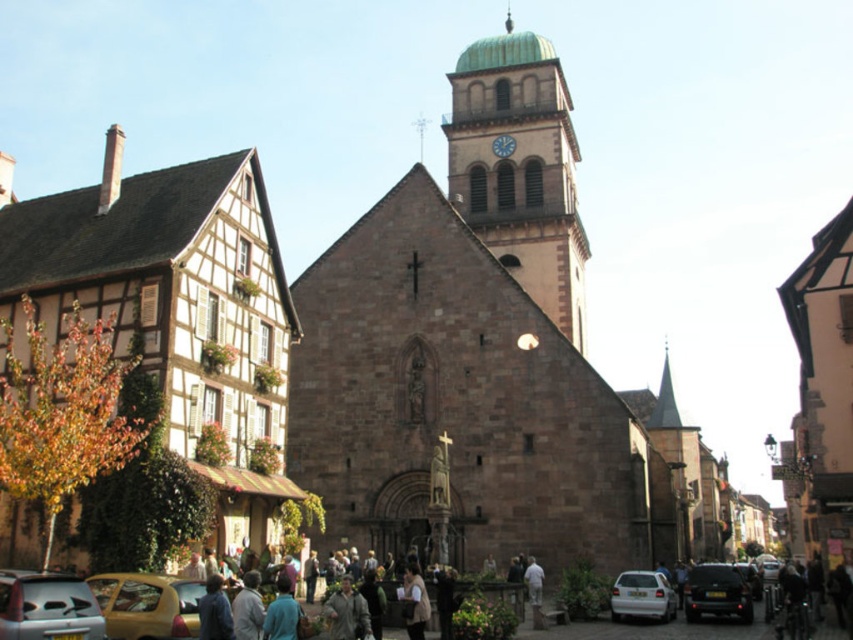
Question: Which of these objects is positioned closest to the wooden half-timbered house at left?

Choices:
 (A) metallic clock at upper center
 (B) gray wool coat at lower center
 (C) metallic silver car at lower left

Answer: (C)

Question: Can you confirm if white matte car at lower center is bigger than metallic clock at upper center?

Choices:
 (A) yes
 (B) no

Answer: (B)

Question: Does white matte car at lower center have a larger size compared to gray wool coat at lower center?

Choices:
 (A) yes
 (B) no

Answer: (B)

Question: Which of the following is the farthest from the observer?

Choices:
 (A) blue fabric shirt at lower center
 (B) white matte car at lower center

Answer: (B)

Question: In this image, where is wooden half-timbered house at left located relative to gray wool coat at lower center?

Choices:
 (A) right
 (B) left

Answer: (B)

Question: Considering the real-world distances, which object is closest to the wooden half-timbered house at left?

Choices:
 (A) yellow matte car at lower left
 (B) blue fabric shirt at lower center

Answer: (B)